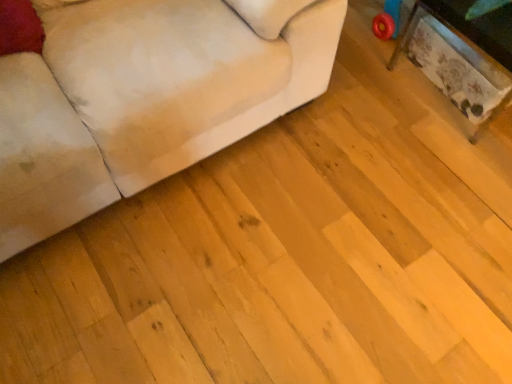
The width and height of the screenshot is (512, 384). Identify the location of suede-like beige couch at lower left. (145, 97).

What do you see at coordinates (145, 97) in the screenshot? This screenshot has height=384, width=512. I see `suede-like beige couch at lower left` at bounding box center [145, 97].

Describe the element at coordinates (403, 37) in the screenshot. I see `wooden textured table at right` at that location.

Identify the location of wooden textured table at right. This screenshot has width=512, height=384. (403, 37).

You are a GUI agent. You are given a task and a screenshot of the screen. Output one action in this format:
    pyautogui.click(x=<x>, y=<y>)
    Task: Click on the suede-like beige couch at lower left
    This screenshot has height=384, width=512.
    Given the screenshot: What is the action you would take?
    pyautogui.click(x=145, y=97)

Which is more to the left, suede-like beige couch at lower left or wooden textured table at right?

suede-like beige couch at lower left is more to the left.

Is suede-like beige couch at lower left positioned behind wooden textured table at right?

No, suede-like beige couch at lower left is closer to the camera.

Is point (8, 116) closer or farther from the camera than point (439, 9)?

Point (8, 116) is closer to the camera than point (439, 9).

From the image's perspective, is suede-like beige couch at lower left above or below wooden textured table at right?

suede-like beige couch at lower left is situated lower than wooden textured table at right in the image.

From a real-world perspective, between suede-like beige couch at lower left and wooden textured table at right, who is vertically higher?

suede-like beige couch at lower left, from a real-world perspective.

Between suede-like beige couch at lower left and wooden textured table at right, which one has smaller width?

wooden textured table at right.

Is suede-like beige couch at lower left shorter than wooden textured table at right?

Incorrect, the height of suede-like beige couch at lower left does not fall short of that of wooden textured table at right.

Considering the relative sizes of suede-like beige couch at lower left and wooden textured table at right in the image provided, is suede-like beige couch at lower left bigger than wooden textured table at right?

Correct, suede-like beige couch at lower left is larger in size than wooden textured table at right.

Would you say suede-like beige couch at lower left is inside or outside wooden textured table at right?

suede-like beige couch at lower left cannot be found inside wooden textured table at right.

Is suede-like beige couch at lower left far from wooden textured table at right?

suede-like beige couch at lower left is near wooden textured table at right, not far away.

Is suede-like beige couch at lower left turned away from wooden textured table at right?

No, suede-like beige couch at lower left's orientation is not away from wooden textured table at right.

What's the angular difference between suede-like beige couch at lower left and wooden textured table at right's facing directions?

There is a 89.1-degree angle between the facing directions of suede-like beige couch at lower left and wooden textured table at right.

Where is `studio couch in front of the wooden textured table at right`? studio couch in front of the wooden textured table at right is located at coordinates (145, 97).

Considering the relative positions of wooden textured table at right and suede-like beige couch at lower left in the image provided, is wooden textured table at right to the right of suede-like beige couch at lower left from the viewer's perspective?

Indeed, wooden textured table at right is positioned on the right side of suede-like beige couch at lower left.

Relative to suede-like beige couch at lower left, is wooden textured table at right in front or behind?

In the image, wooden textured table at right appears behind suede-like beige couch at lower left.

Considering the positions of point (400, 49) and point (274, 53), is point (400, 49) closer or farther from the camera than point (274, 53)?

Point (400, 49).

From the image's perspective, is wooden textured table at right located above or below suede-like beige couch at lower left?

wooden textured table at right is situated higher than suede-like beige couch at lower left in the image.

Consider the image. From a real-world perspective, between wooden textured table at right and suede-like beige couch at lower left, who is vertically lower?

From a 3D spatial view, wooden textured table at right is below.

Does wooden textured table at right have a lesser width compared to suede-like beige couch at lower left?

Yes.

Can you confirm if wooden textured table at right is shorter than suede-like beige couch at lower left?

Yes, wooden textured table at right is shorter than suede-like beige couch at lower left.

Who is bigger, wooden textured table at right or suede-like beige couch at lower left?

suede-like beige couch at lower left is bigger.

Could suede-like beige couch at lower left be considered to be inside wooden textured table at right?

No, suede-like beige couch at lower left is not a part of wooden textured table at right.

Is wooden textured table at right not near suede-like beige couch at lower left?

No, wooden textured table at right is not far away from suede-like beige couch at lower left.

Is wooden textured table at right aimed at suede-like beige couch at lower left?

Yes.

Based on the photo, how different are the orientations of wooden textured table at right and suede-like beige couch at lower left in degrees?

They differ by 89.1 degrees in their facing directions.

How much distance is there between wooden textured table at right and suede-like beige couch at lower left?

wooden textured table at right is 36.86 inches away from suede-like beige couch at lower left.

At what (x,y) coordinates should I click in order to perform the action: click on table to the right of suede-like beige couch at lower left. Please return your answer as a coordinate pair (x, y). The width and height of the screenshot is (512, 384). Looking at the image, I should click on (403, 37).

Locate an element on the screen. table behind the suede-like beige couch at lower left is located at coordinates (403, 37).

Where is `studio couch below the wooden textured table at right (from the image's perspective)`? The height and width of the screenshot is (384, 512). studio couch below the wooden textured table at right (from the image's perspective) is located at coordinates (145, 97).